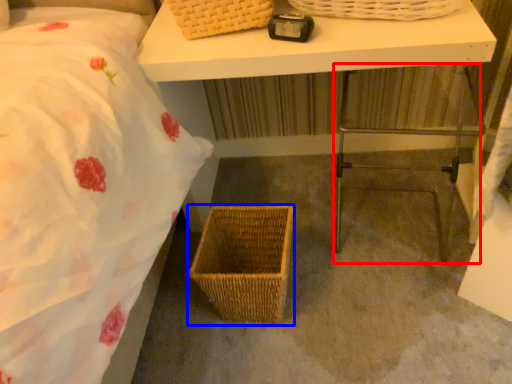
Question: Which object appears closest to the camera in this image, step stool (highlighted by a red box) or picnic basket (highlighted by a blue box)?

Choices:
 (A) step stool
 (B) picnic basket

Answer: (A)